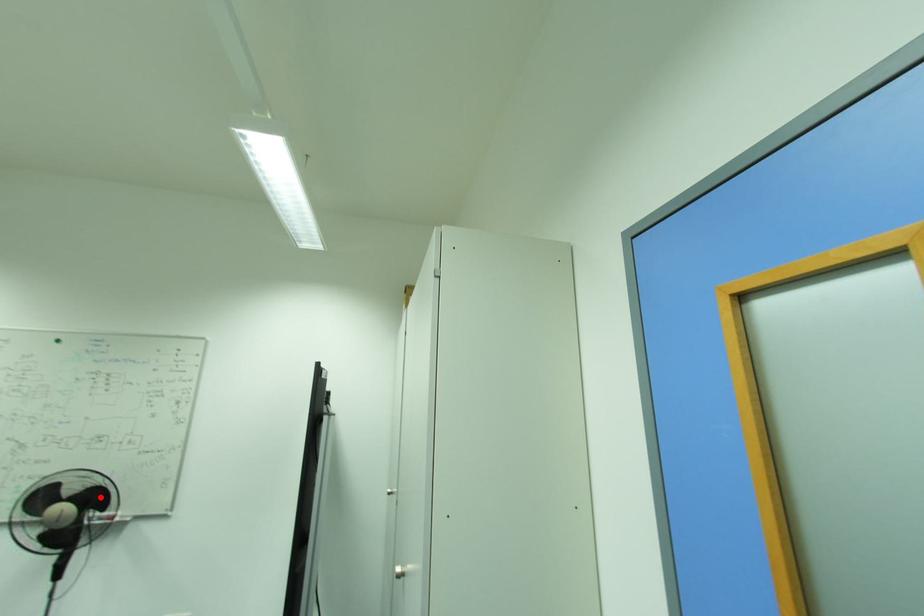
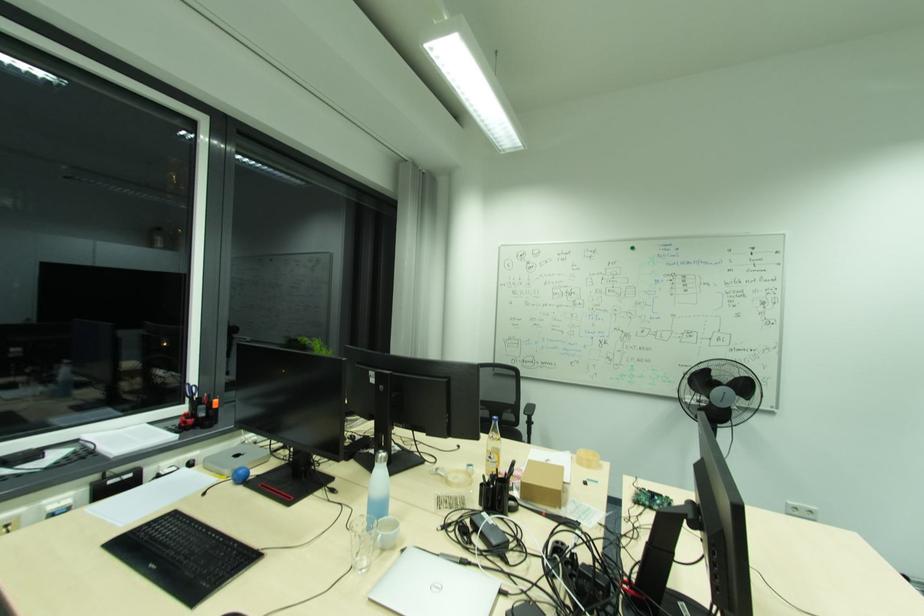
In the second image, find the point that corresponds to the highlighted location in the first image.

(748, 387)